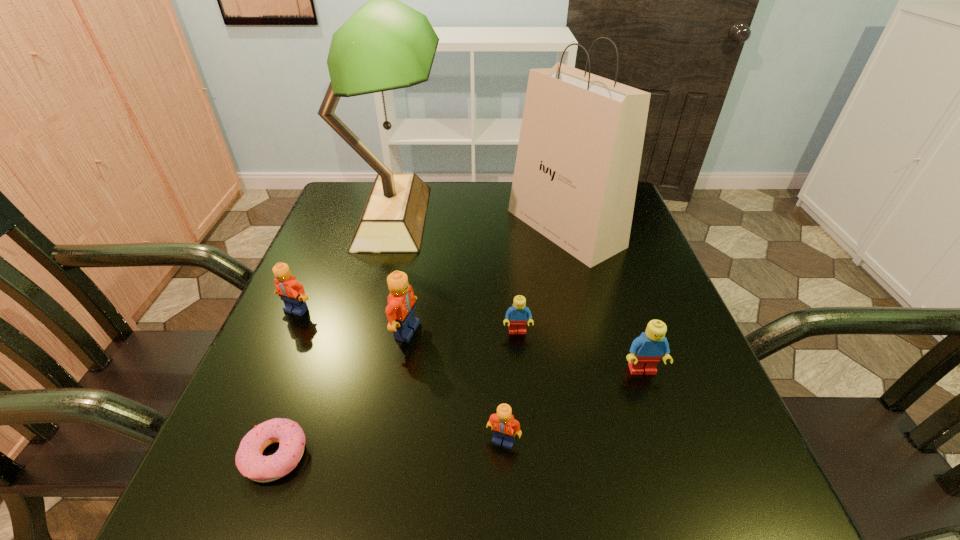
Find the location of a particular element. This screenshot has width=960, height=540. the closest Lego to the rightmost orange Lego is located at coordinates (517, 315).

The image size is (960, 540). In order to click on orange Lego that stands as the closest to the second Lego from left to right in this screenshot , I will do `click(292, 293)`.

The height and width of the screenshot is (540, 960). In order to click on orange Lego identified as the closest to the leftmost orange Lego in this screenshot , I will do click(400, 310).

The image size is (960, 540). I want to click on vacant region that satisfies the following two spatial constraints: 1. on the metallic stand of the green table lamp; 2. on the left side of the shopping bag, so click(390, 228).